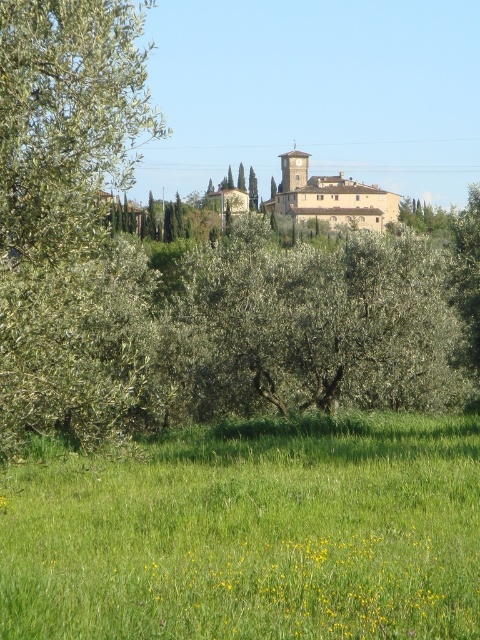
Which is more to the right, green grassy field at lower center or green leafy tree at left?

From the viewer's perspective, green grassy field at lower center appears more on the right side.

Does green grassy field at lower center have a larger size compared to green leafy tree at left?

Actually, green grassy field at lower center might be smaller than green leafy tree at left.

The width and height of the screenshot is (480, 640). I want to click on green grassy field at lower center, so pos(252,536).